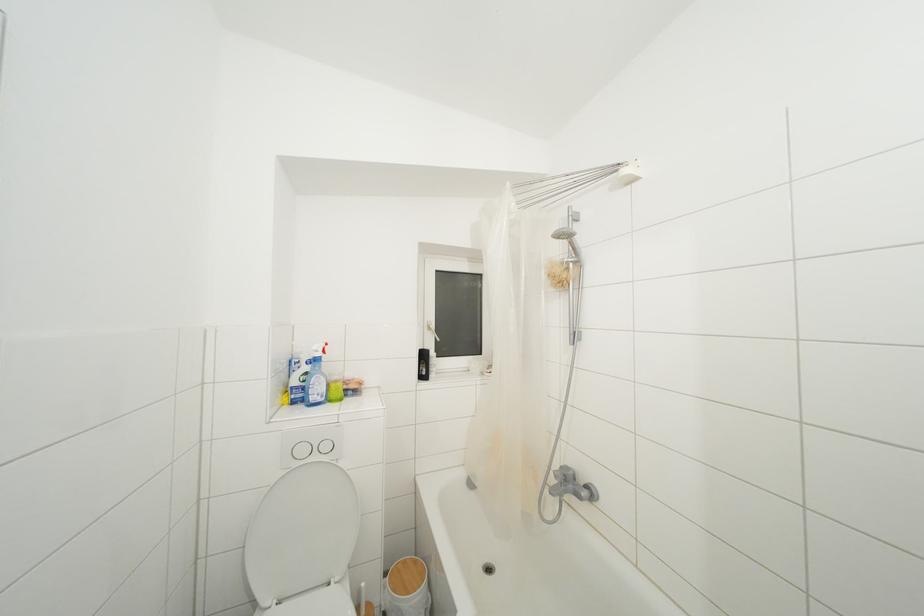
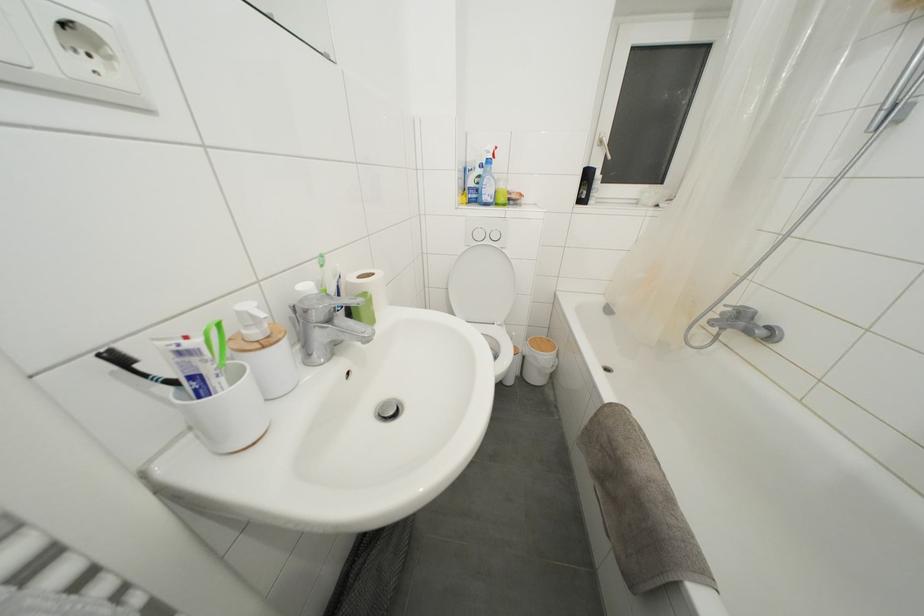
First-person continuous shooting, in which direction is the camera rotating?

The camera rotated toward left-down.